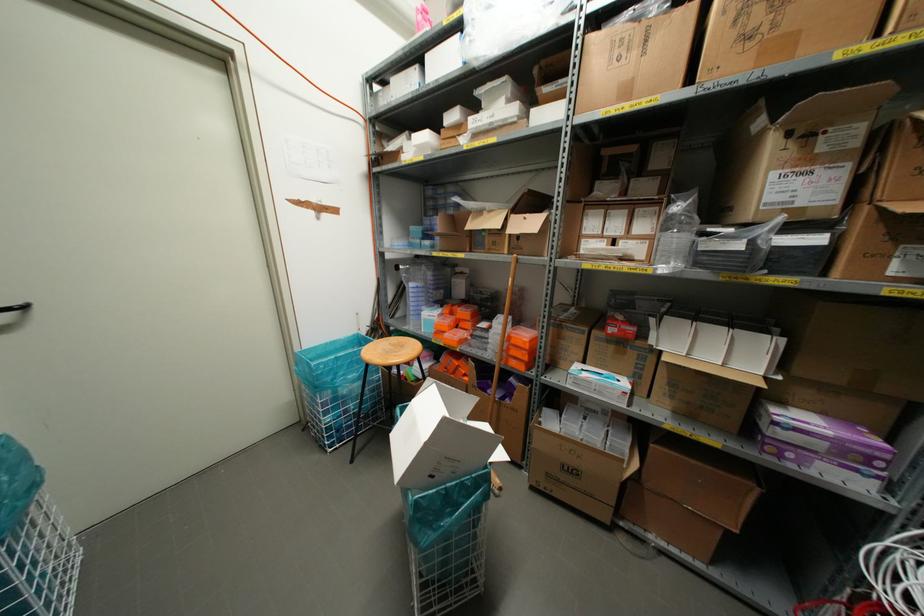
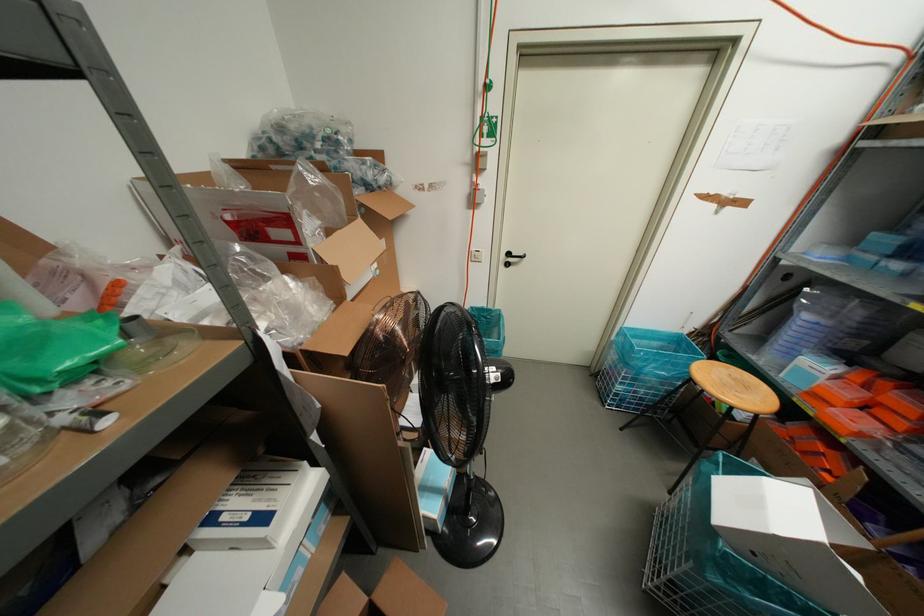
Locate, in the second image, the point that corresponds to (416,229) in the first image.

(885, 240)